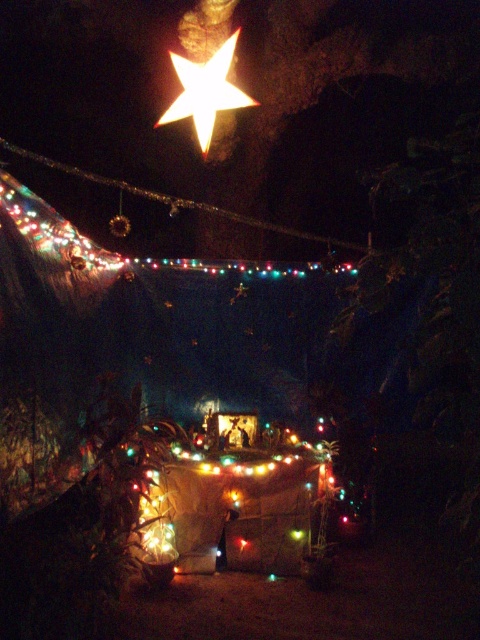
Question: Which point is farther from the camera taking this photo?

Choices:
 (A) (235, 33)
 (B) (277, 228)

Answer: (B)

Question: Does bright white paper star at upper center lie in front of multicolored lights at upper center?

Choices:
 (A) no
 (B) yes

Answer: (A)

Question: Does bright white paper star at upper center lie in front of multicolored lights at upper center?

Choices:
 (A) yes
 (B) no

Answer: (B)

Question: Which point is farther to the camera?

Choices:
 (A) bright white paper star at upper center
 (B) multicolored lights at upper center

Answer: (A)

Question: Does bright white paper star at upper center appear under multicolored lights at upper center?

Choices:
 (A) no
 (B) yes

Answer: (A)